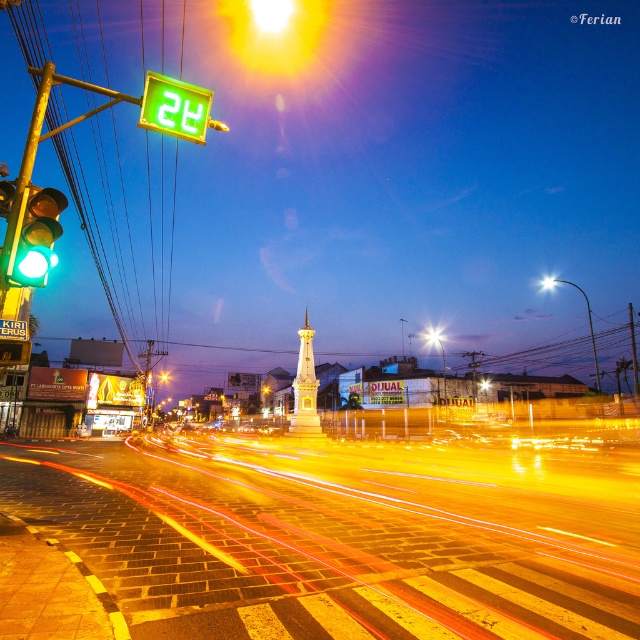
In the scene shown: Is white glossy street light at center in front of yellow glass street light at upper center?

No.

Which is behind, point (428, 333) or point (147, 392)?

Positioned behind is point (428, 333).

Identify the location of white glossy street light at center. This screenshot has width=640, height=640. (440, 349).

Does yellow brick road at center appear on the left side of green plastic sign at upper left?

Yes, yellow brick road at center is to the left of green plastic sign at upper left.

How much distance is there between yellow brick road at center and green plastic sign at upper left?

yellow brick road at center is 26.95 meters from green plastic sign at upper left.

Does point (486, 497) come behind point (198, 97)?

Yes, it is.

Identify the location of yellow brick road at center. Image resolution: width=640 pixels, height=640 pixels. (332, 541).

Does point (496, 461) lie behind point (512, 413)?

No, (496, 461) is closer to viewer.

This screenshot has width=640, height=640. Describe the element at coordinates (332, 541) in the screenshot. I see `yellow brick road at center` at that location.

Does point (554, 493) come farther from viewer compared to point (486, 403)?

That is False.

You are a GUI agent. You are given a task and a screenshot of the screen. Output one action in this format:
    pyautogui.click(x=<x>, y=<y>)
    Task: Click on the yellow brick road at center
    The width and height of the screenshot is (640, 640).
    Given the screenshot: What is the action you would take?
    pyautogui.click(x=332, y=541)